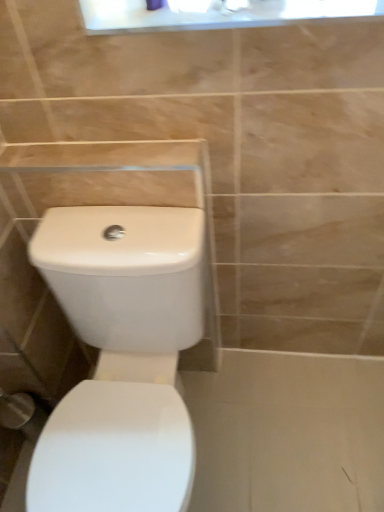
At what (x,y) coordinates should I click in order to perform the action: click on white glossy toilet at center. Please return your answer as a coordinate pair (x, y). The width and height of the screenshot is (384, 512). Looking at the image, I should click on (121, 357).

In order to face white glossy toilet at center, should I rotate leftwards or rightwards?

It's best to rotate left around 8.654 degrees.

The width and height of the screenshot is (384, 512). What do you see at coordinates (121, 357) in the screenshot?
I see `white glossy toilet at center` at bounding box center [121, 357].

Where is `white glossy medicine cabinet at upper center`? The width and height of the screenshot is (384, 512). white glossy medicine cabinet at upper center is located at coordinates (216, 13).

What do you see at coordinates (216, 13) in the screenshot? I see `white glossy medicine cabinet at upper center` at bounding box center [216, 13].

Identify the location of white glossy toilet at center. The height and width of the screenshot is (512, 384). (121, 357).

Considering the relative positions of white glossy medicine cabinet at upper center and white glossy toilet at center in the image provided, is white glossy medicine cabinet at upper center to the right of white glossy toilet at center from the viewer's perspective?

Yes.

Which is behind, white glossy medicine cabinet at upper center or white glossy toilet at center?

Positioned behind is white glossy medicine cabinet at upper center.

Is point (100, 25) closer to viewer compared to point (156, 453)?

Yes, it is.

From the image's perspective, is white glossy medicine cabinet at upper center on top of white glossy toilet at center?

Yes, from the image's perspective, white glossy medicine cabinet at upper center is over white glossy toilet at center.

From a real-world perspective, is white glossy medicine cabinet at upper center positioned over white glossy toilet at center based on gravity?

Yes.

Between white glossy medicine cabinet at upper center and white glossy toilet at center, which one has larger width?

white glossy toilet at center is wider.

Does white glossy medicine cabinet at upper center have a lesser height compared to white glossy toilet at center?

Yes, white glossy medicine cabinet at upper center is shorter than white glossy toilet at center.

Considering the sizes of white glossy medicine cabinet at upper center and white glossy toilet at center in the image, is white glossy medicine cabinet at upper center bigger or smaller than white glossy toilet at center?

white glossy medicine cabinet at upper center is smaller than white glossy toilet at center.

Is white glossy medicine cabinet at upper center not inside white glossy toilet at center?

Absolutely, white glossy medicine cabinet at upper center is external to white glossy toilet at center.

Looking at this image, are white glossy medicine cabinet at upper center and white glossy toilet at center beside each other?

white glossy medicine cabinet at upper center is not next to white glossy toilet at center, and they're not touching.

Is white glossy medicine cabinet at upper center oriented away from white glossy toilet at center?

No, white glossy medicine cabinet at upper center's orientation is not away from white glossy toilet at center.

How different are the orientations of white glossy medicine cabinet at upper center and white glossy toilet at center in degrees?

0.242 degrees.

Locate an element on the screen. The height and width of the screenshot is (512, 384). medicine cabinet that appears on the right of white glossy toilet at center is located at coordinates (216, 13).

Based on their positions, is white glossy toilet at center located to the left or right of white glossy medicine cabinet at upper center?

Based on their positions, white glossy toilet at center is located to the left of white glossy medicine cabinet at upper center.

Is white glossy toilet at center in front of or behind white glossy medicine cabinet at upper center in the image?

Visually, white glossy toilet at center is located in front of white glossy medicine cabinet at upper center.

Is point (142, 212) more distant than point (306, 2)?

Yes, it is.

In the scene shown: From the image's perspective, is white glossy toilet at center under white glossy medicine cabinet at upper center?

Indeed, from the image's perspective, white glossy toilet at center is shown beneath white glossy medicine cabinet at upper center.

From a real-world perspective, relative to white glossy medicine cabinet at upper center, is white glossy toilet at center vertically above or below?

white glossy toilet at center is situated lower than white glossy medicine cabinet at upper center in the real world.

Does white glossy toilet at center have a greater width compared to white glossy medicine cabinet at upper center?

Yes.

Looking at this image, is white glossy toilet at center taller than white glossy medicine cabinet at upper center?

Indeed, white glossy toilet at center has a greater height compared to white glossy medicine cabinet at upper center.

Consider the image. Looking at the image, does white glossy toilet at center seem bigger or smaller compared to white glossy medicine cabinet at upper center?

Clearly, white glossy toilet at center is larger in size than white glossy medicine cabinet at upper center.

Is white glossy toilet at center inside or outside of white glossy medicine cabinet at upper center?

white glossy toilet at center is not enclosed by white glossy medicine cabinet at upper center.

Are white glossy toilet at center and white glossy medicine cabinet at upper center far apart?

white glossy toilet at center is actually quite close to white glossy medicine cabinet at upper center.

Could you tell me if white glossy toilet at center is turned towards white glossy medicine cabinet at upper center?

No, white glossy toilet at center does not turn towards white glossy medicine cabinet at upper center.

Can you tell me how much white glossy toilet at center and white glossy medicine cabinet at upper center differ in facing direction?

The facing directions of white glossy toilet at center and white glossy medicine cabinet at upper center are 0.242 degrees apart.

Where is `medicine cabinet behind the white glossy toilet at center`? The width and height of the screenshot is (384, 512). medicine cabinet behind the white glossy toilet at center is located at coordinates (216, 13).

This screenshot has height=512, width=384. What are the coordinates of `medicine cabinet above the white glossy toilet at center (from a real-world perspective)` in the screenshot? It's located at (216, 13).

In the image, there is a white glossy toilet at center. Find the location of `medicine cabinet above it (from the image's perspective)`. medicine cabinet above it (from the image's perspective) is located at coordinates (216, 13).